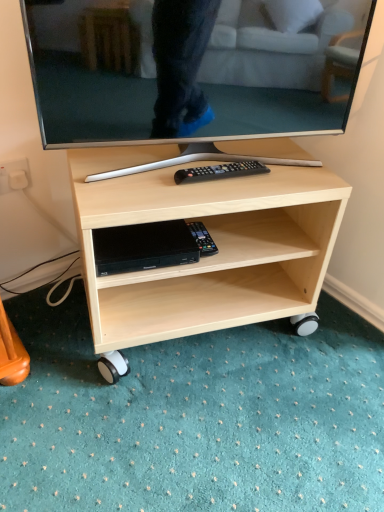
In order to click on free region under matte black tv at center (from a real-world perspective) in this screenshot , I will do (x=183, y=158).